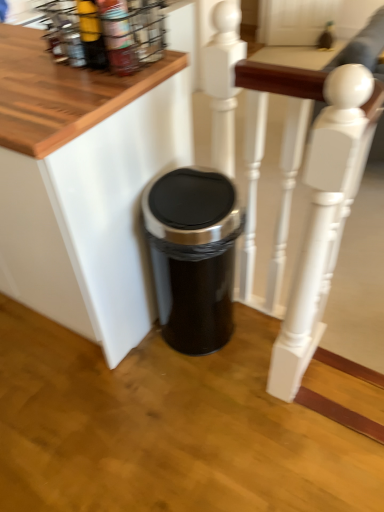
Question: Visually, is metallic wire spice rack at upper left positioned to the left or to the right of black plastic trash can at lower center?

Choices:
 (A) left
 (B) right

Answer: (B)

Question: Relative to black plastic trash can at lower center, is metallic wire spice rack at upper left in front or behind?

Choices:
 (A) behind
 (B) front

Answer: (A)

Question: Based on their relative distances, which object is nearer to the black metallic trash can at center?

Choices:
 (A) metallic wire spice rack at upper left
 (B) white painted wood at center
 (C) matte yellow bottle at upper left
 (D) black plastic trash can at lower center

Answer: (D)

Question: Based on their relative distances, which object is farther from the metallic wire spice rack at upper left?

Choices:
 (A) black metallic trash can at center
 (B) white painted wood at center
 (C) black plastic trash can at lower center
 (D) matte yellow bottle at upper left

Answer: (A)